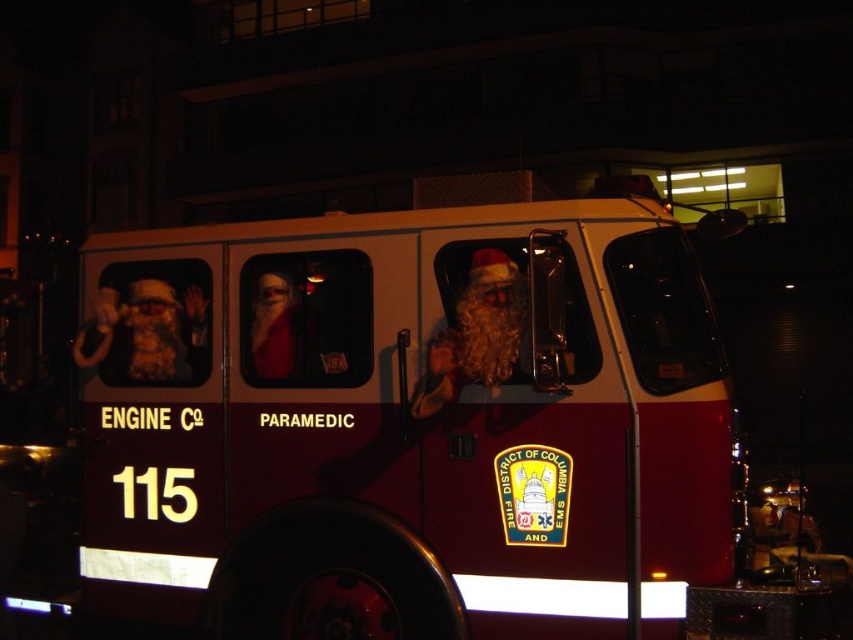
Does maroon matte fire truck at center have a greater height compared to white fluffy santa at center?

Correct, maroon matte fire truck at center is much taller as white fluffy santa at center.

Can you confirm if maroon matte fire truck at center is positioned to the right of white fluffy santa at center?

In fact, maroon matte fire truck at center is to the left of white fluffy santa at center.

At what (x,y) coordinates should I click in order to perform the action: click on maroon matte fire truck at center. Please return your answer as a coordinate pair (x, y). This screenshot has width=853, height=640. Looking at the image, I should click on (410, 426).